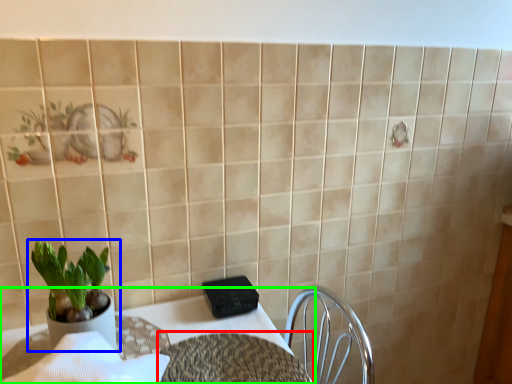
Question: Estimate the real-world distances between objects in this image. Which object is farther from round table (highlighted by a red box), houseplant (highlighted by a blue box) or table (highlighted by a green box)?

Choices:
 (A) houseplant
 (B) table

Answer: (A)